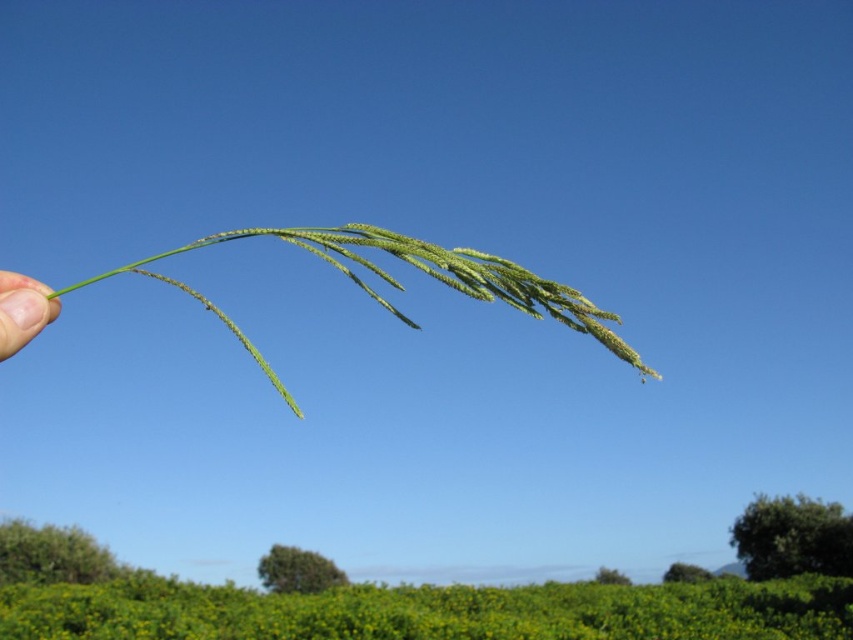
You are standing in a meadow and see the green matte grass at center and the green leafy hedge at lower right. Which object is located to the left of the other?

The green matte grass at center is positioned on the left side of green leafy hedge at lower right.

You are a gardener trying to distinguish between two plants in your garden. You see the green matte grass at center and the skinny green stem at left. Which one has a thicker stem?

The green matte grass at center might be wider than the skinny green stem at left, so the green matte grass at center likely has a thicker stem.